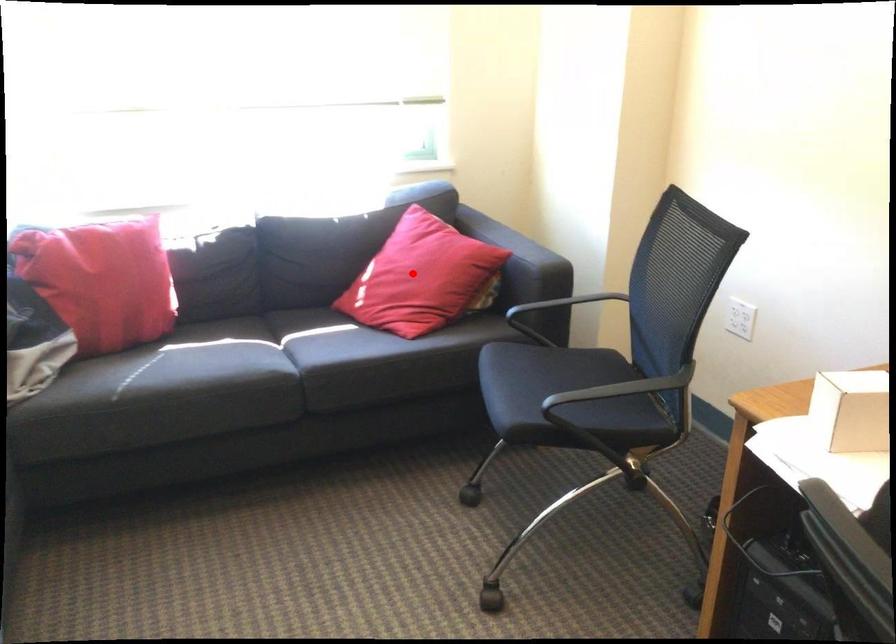
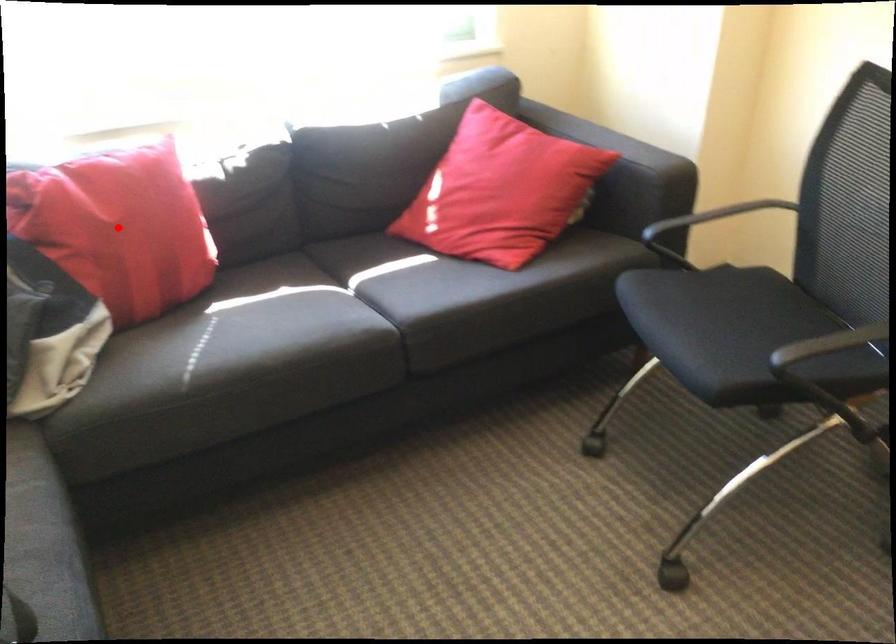
I am providing you with two images of the same scene from different viewpoints. A red point is marked on the first image and another point is marked on the second image. Does the point marked in image1 correspond to the same location as the one in image2?

No